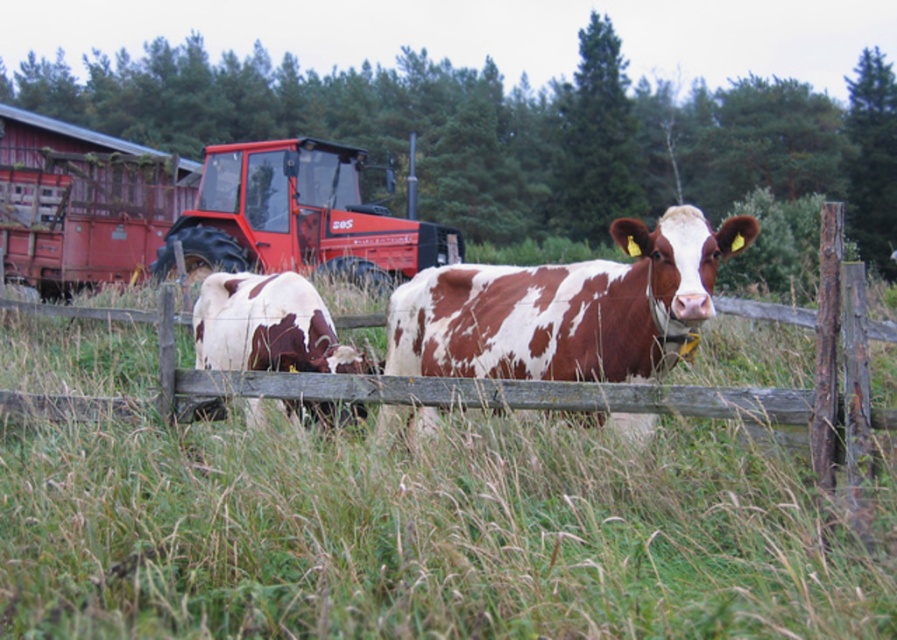
Question: Can you confirm if brown and white speckled cow at center is smaller than metallic red tractor at center?

Choices:
 (A) no
 (B) yes

Answer: (B)

Question: Estimate the real-world distances between objects in this image. Which object is closer to the brown and white speckled cow at center?

Choices:
 (A) brown spotted fur at center
 (B) metallic red tractor at center
 (C) wooden fence at center

Answer: (C)

Question: Does wooden fence at center appear on the left side of brown spotted fur at center?

Choices:
 (A) no
 (B) yes

Answer: (A)

Question: Which of these objects is positioned closest to the brown and white speckled cow at center?

Choices:
 (A) metallic red tractor at center
 (B) brown spotted fur at center

Answer: (B)

Question: Estimate the real-world distances between objects in this image. Which object is farther from the wooden fence at center?

Choices:
 (A) metallic red tractor at center
 (B) brown and white speckled cow at center
 (C) brown spotted fur at center

Answer: (A)

Question: Can you confirm if brown and white speckled cow at center is positioned below metallic red tractor at center?

Choices:
 (A) yes
 (B) no

Answer: (A)